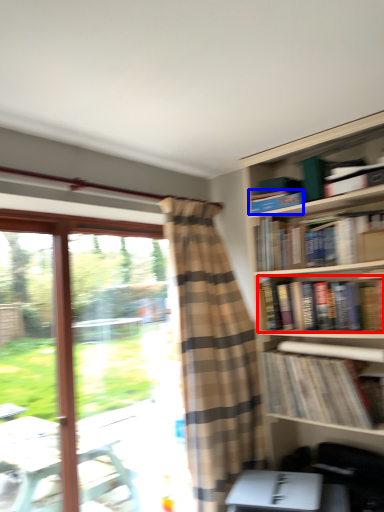
Question: Among these objects, which one is nearest to the camera, book (highlighted by a red box) or book (highlighted by a blue box)?

Choices:
 (A) book
 (B) book

Answer: (A)